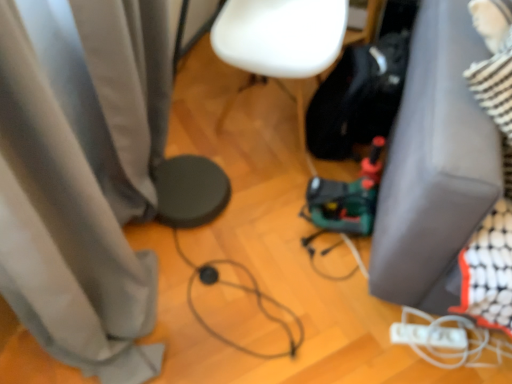
Question: Is black cable at center shorter than white matte wii controller at lower right?

Choices:
 (A) yes
 (B) no

Answer: (B)

Question: Is black cable at center turned away from white matte wii controller at lower right?

Choices:
 (A) no
 (B) yes

Answer: (A)

Question: Can you confirm if black cable at center is smaller than white matte wii controller at lower right?

Choices:
 (A) no
 (B) yes

Answer: (A)

Question: Does black cable at center appear on the left side of white matte wii controller at lower right?

Choices:
 (A) yes
 (B) no

Answer: (A)

Question: Can you confirm if black cable at center is bigger than white matte wii controller at lower right?

Choices:
 (A) yes
 (B) no

Answer: (A)

Question: Is black cable at center thinner than white matte wii controller at lower right?

Choices:
 (A) yes
 (B) no

Answer: (B)

Question: Is white matte chair at center far away from black cable at center?

Choices:
 (A) yes
 (B) no

Answer: (B)

Question: From the image's perspective, would you say white matte chair at center is shown under black cable at center?

Choices:
 (A) yes
 (B) no

Answer: (B)

Question: Does white matte chair at center have a larger size compared to black cable at center?

Choices:
 (A) no
 (B) yes

Answer: (B)

Question: Considering the relative sizes of white matte chair at center and black cable at center in the image provided, is white matte chair at center taller than black cable at center?

Choices:
 (A) no
 (B) yes

Answer: (B)

Question: Is the position of white matte chair at center less distant than that of black cable at center?

Choices:
 (A) no
 (B) yes

Answer: (B)

Question: Is white matte chair at center not within black cable at center?

Choices:
 (A) yes
 (B) no

Answer: (A)

Question: From a real-world perspective, is white matte chair at center on gray fabric couch at lower right?

Choices:
 (A) no
 (B) yes

Answer: (A)